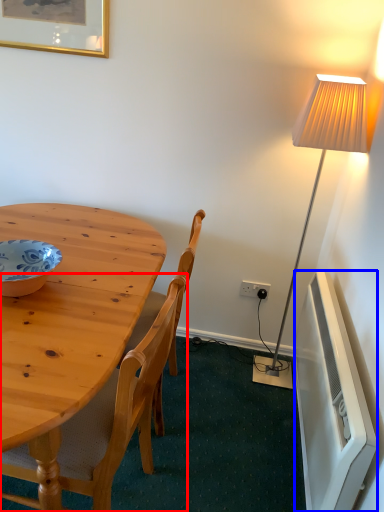
Question: Which object appears farthest to the camera in this image, chair (highlighted by a red box) or radiator (highlighted by a blue box)?

Choices:
 (A) chair
 (B) radiator

Answer: (B)